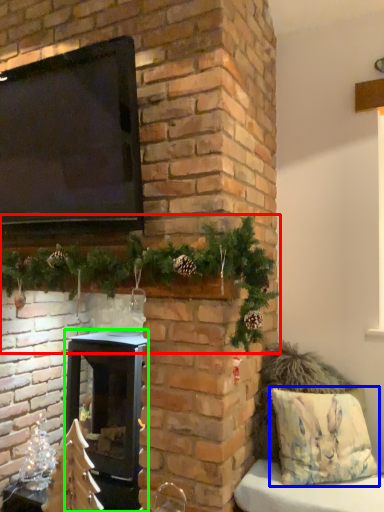
Question: Which is nearer to the christmas decoration (highlighted by a red box)? pillow (highlighted by a blue box) or wood burning stove (highlighted by a green box).

Choices:
 (A) pillow
 (B) wood burning stove

Answer: (B)